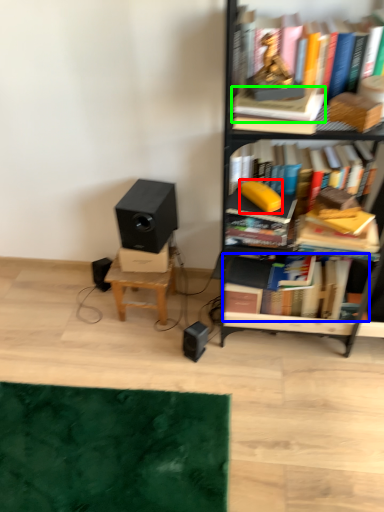
Question: Which object is positioned closest to paperback book (highlighted by a red box)? Select from book (highlighted by a blue box) and paperback book (highlighted by a green box).

Choices:
 (A) book
 (B) paperback book

Answer: (B)